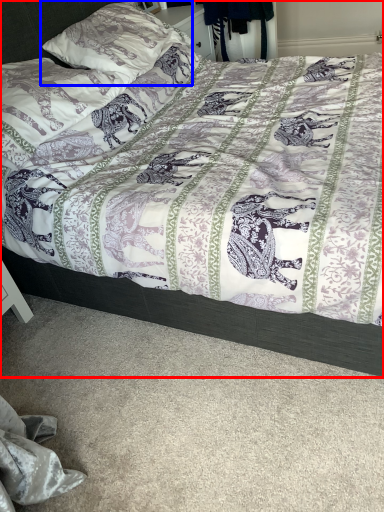
Question: Among these objects, which one is nearest to the camera, bed (highlighted by a red box) or pillow (highlighted by a blue box)?

Choices:
 (A) bed
 (B) pillow

Answer: (A)